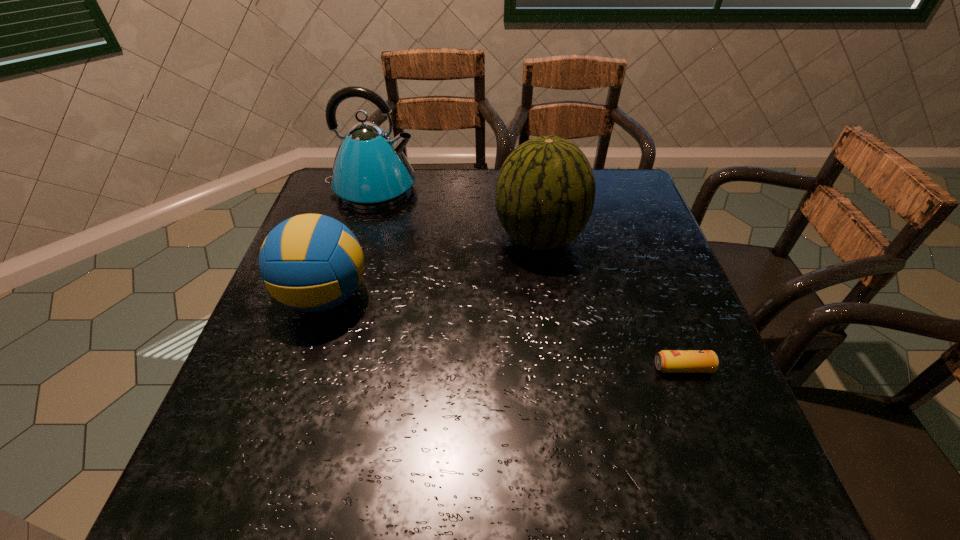
You are a GUI agent. You are given a task and a screenshot of the screen. Output one action in this format:
    pyautogui.click(x=<x>, y=<y>)
    Task: Click on the watermelon that is positioned at the far edge
    The image size is (960, 540).
    Given the screenshot: What is the action you would take?
    pyautogui.click(x=545, y=192)

Locate an element on the screen. The width and height of the screenshot is (960, 540). kettle that is at the left edge is located at coordinates (370, 171).

Identify the location of volleyball that is at the left edge. This screenshot has width=960, height=540. (310, 262).

Where is `object present at the right edge`? object present at the right edge is located at coordinates (668, 361).

What are the coordinates of `object that is at the far left corner` in the screenshot? It's located at (370, 171).

Where is `vacant space at the far edge of the desktop`? vacant space at the far edge of the desktop is located at coordinates (423, 204).

Identify the location of free point at the near edge. The height and width of the screenshot is (540, 960). (402, 461).

In the image, there is a desktop. Find the location of `vacant space at the left edge`. vacant space at the left edge is located at coordinates (360, 242).

What are the coordinates of `vacant space at the right edge` in the screenshot? It's located at (674, 307).

This screenshot has height=540, width=960. I want to click on vacant space at the far left corner of the desktop, so click(x=337, y=211).